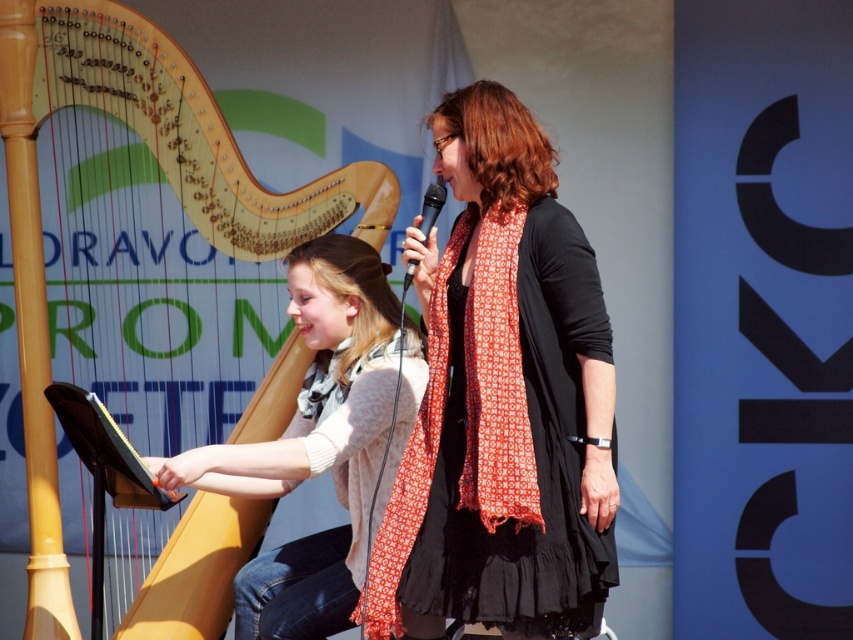
Question: Is matte black dress at center positioned behind wooden harp at left?

Choices:
 (A) yes
 (B) no

Answer: (B)

Question: Can you confirm if wooden harp at left is positioned above orange printed scarf at center?

Choices:
 (A) yes
 (B) no

Answer: (A)

Question: Which object is farther from the camera taking this photo?

Choices:
 (A) light beige sweater at center
 (B) matte black dress at center
 (C) wooden harp at left
 (D) black plastic microphone at center

Answer: (C)

Question: Among these points, which one is nearest to the camera?

Choices:
 (A) (44, 365)
 (B) (486, 621)

Answer: (B)

Question: Is matte black dress at center positioned at the back of orange printed scarf at center?

Choices:
 (A) yes
 (B) no

Answer: (B)

Question: Among these points, which one is farthest from the camera?

Choices:
 (A) (57, 284)
 (B) (498, 428)
 (C) (422, 204)
 (D) (378, 406)

Answer: (A)